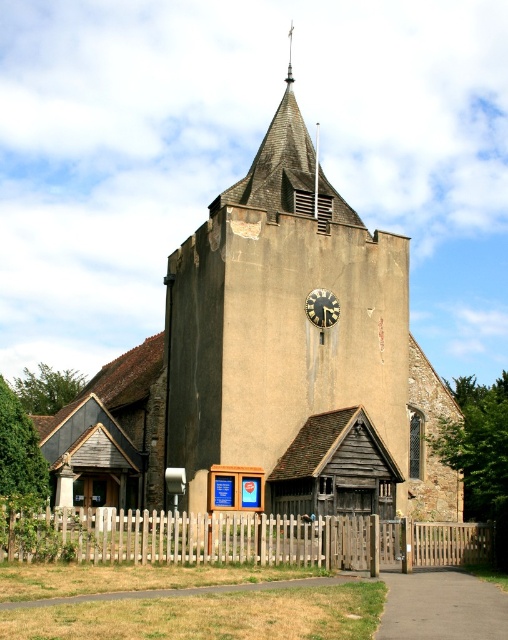
You are standing in front of the church and looking at the clock tower. There are two points marked on the tower. One is at coordinate point (139, 474) and the other is at point (321, 307). Which point is closer to you?

Point (139, 474) is closer to you because it is further to the viewer than point (321, 307).

You are standing in front of the brown stone church at center and the black metal clock at center. Which object is closer to you?

The brown stone church at center is closer to you because it is in front of the black metal clock at center.

From the picture: You are standing at the entrance of the church and want to walk towards the black metal clock at center. Which direction should you move relative to the white wooden fence at lower center?

Since the white wooden fence at lower center is to the left of the black metal clock at center, you should move to the right of the white wooden fence at lower center to reach the black metal clock at center.